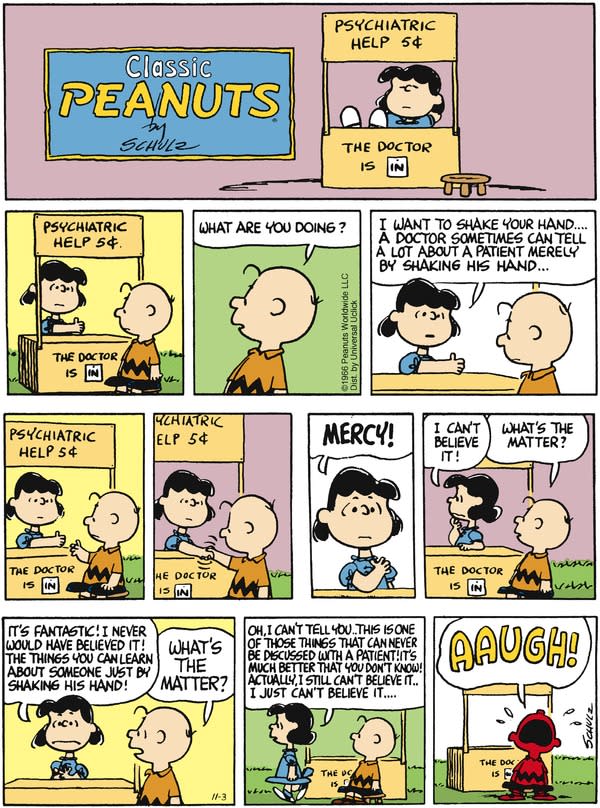
Identify the location of booth. (345, 162), (82, 356), (23, 556), (177, 567), (101, 777), (323, 766), (474, 764), (454, 571).